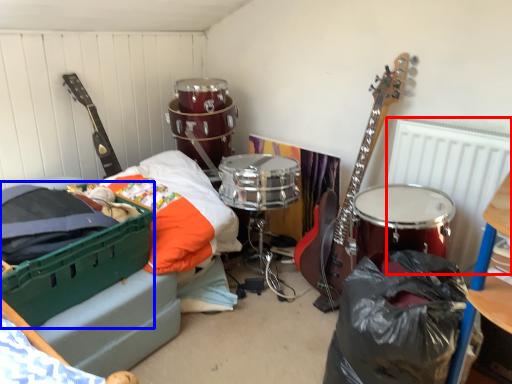
Question: Which of the following is the farthest to the observer, radiator (highlighted by a red box) or storage box (highlighted by a blue box)?

Choices:
 (A) radiator
 (B) storage box

Answer: (A)